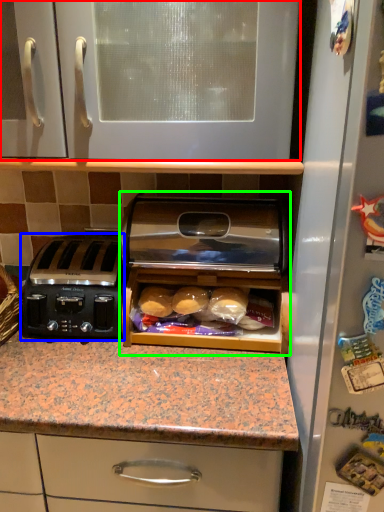
Question: Estimate the real-world distances between objects in this image. Which object is farther from cabinetry (highlighted by a red box), toaster (highlighted by a blue box) or home appliance (highlighted by a green box)?

Choices:
 (A) toaster
 (B) home appliance

Answer: (A)